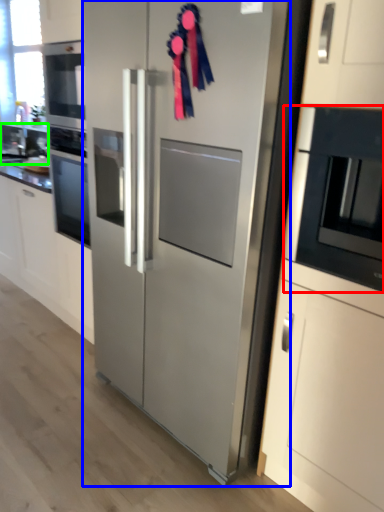
Question: Based on their relative distances, which object is farther from microwave oven (highlighted by a red box)? Choose from refrigerator (highlighted by a blue box) and sink (highlighted by a green box).

Choices:
 (A) refrigerator
 (B) sink

Answer: (B)